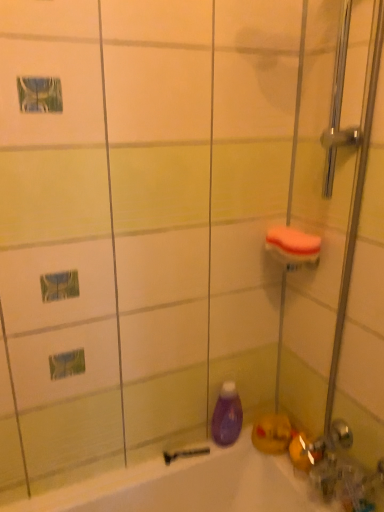
Question: Is orange sponge at upper right positioned behind clear glass shower door at right?

Choices:
 (A) no
 (B) yes

Answer: (B)

Question: From a real-world perspective, is orange sponge at upper right under clear glass shower door at right?

Choices:
 (A) no
 (B) yes

Answer: (A)

Question: From the image's perspective, is orange sponge at upper right located beneath clear glass shower door at right?

Choices:
 (A) yes
 (B) no

Answer: (B)

Question: Is orange sponge at upper right far from clear glass shower door at right?

Choices:
 (A) no
 (B) yes

Answer: (A)

Question: Is orange sponge at upper right to the left of clear glass shower door at right from the viewer's perspective?

Choices:
 (A) yes
 (B) no

Answer: (A)

Question: From the image's perspective, is black rubber razor at lower center positioned above or below clear glass shower door at right?

Choices:
 (A) above
 (B) below

Answer: (B)

Question: Does point (195, 453) appear closer or farther from the camera than point (344, 59)?

Choices:
 (A) farther
 (B) closer

Answer: (A)

Question: Is black rubber razor at lower center wider or thinner than clear glass shower door at right?

Choices:
 (A) wide
 (B) thin

Answer: (B)

Question: Choose the correct answer: Is black rubber razor at lower center inside clear glass shower door at right or outside it?

Choices:
 (A) outside
 (B) inside

Answer: (A)

Question: Considering the positions of purple glossy bottle at lower center and clear glass shower door at right in the image, is purple glossy bottle at lower center wider or thinner than clear glass shower door at right?

Choices:
 (A) wide
 (B) thin

Answer: (B)

Question: Considering the relative positions of purple glossy bottle at lower center and clear glass shower door at right in the image provided, is purple glossy bottle at lower center to the left or to the right of clear glass shower door at right?

Choices:
 (A) left
 (B) right

Answer: (A)

Question: Is purple glossy bottle at lower center situated inside clear glass shower door at right or outside?

Choices:
 (A) outside
 (B) inside

Answer: (A)

Question: Considering their positions, is purple glossy bottle at lower center located in front of or behind clear glass shower door at right?

Choices:
 (A) behind
 (B) front

Answer: (A)

Question: Is orange sponge at upper right wider or thinner than clear glass shower door at right?

Choices:
 (A) wide
 (B) thin

Answer: (B)

Question: Is orange sponge at upper right taller or shorter than clear glass shower door at right?

Choices:
 (A) tall
 (B) short

Answer: (B)